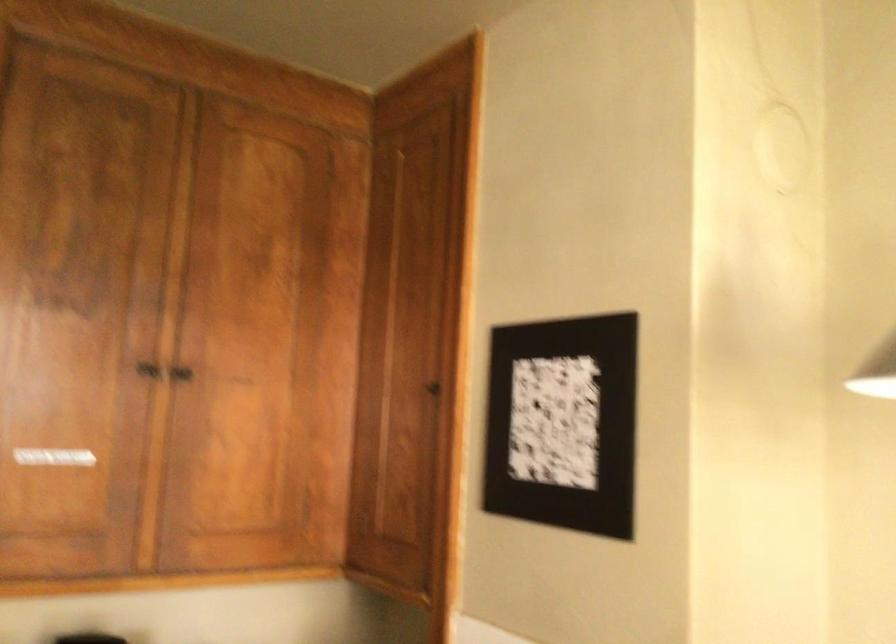
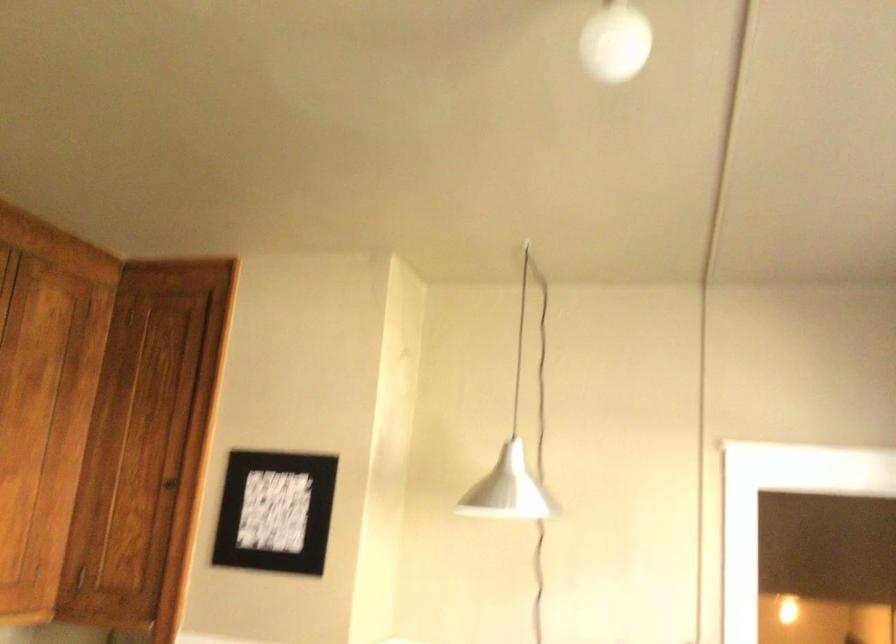
Locate, in the second image, the point that corresponds to (x=545, y=419) in the first image.

(274, 512)